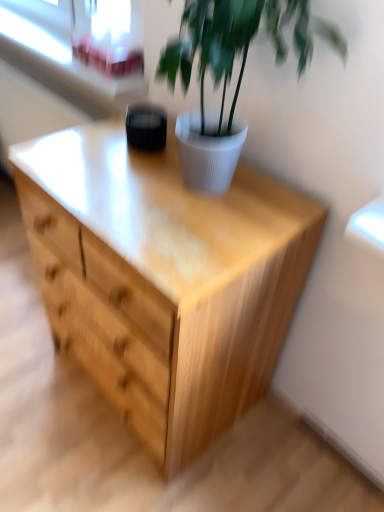
Where is `blank space situated above transparent glass window screen at upper left (from a real-world perspective)`? The width and height of the screenshot is (384, 512). blank space situated above transparent glass window screen at upper left (from a real-world perspective) is located at coordinates (107, 17).